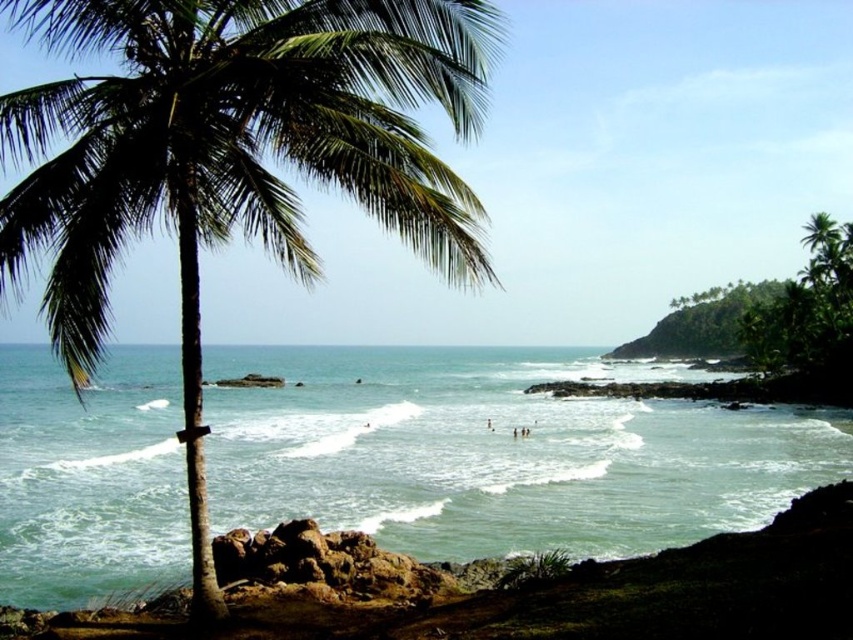
You are standing on the beach and want to walk from the palm tree to the ocean. There is green water at center and a skinny person at center in your way. Which object is wider so you can walk around it easily?

The green water at center is wider than the skinny person at center, so you can walk around the skinny person at center more easily.

You are a swimmer looking to enter the water near the green leafy palm tree at left. Based on the scene, where would you find the green water at center relative to the palm tree?

The green water at center is located below the green leafy palm tree at left, so you would find it directly in front of the palm tree as you face the ocean.

You are standing at the center of the image and want to collect some sand. Which direction should you move to reach the green sand at lower left?

You should move to the lower left direction to reach the green sand at lower left, as it is located at point (x=508, y=589).